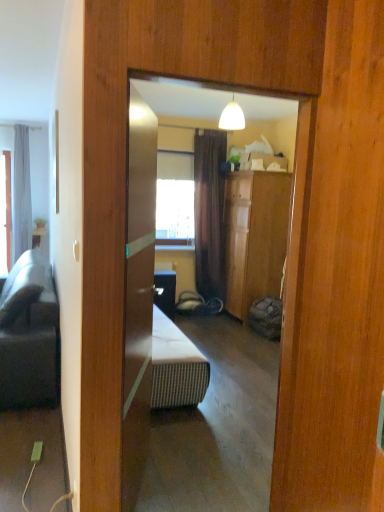
Question: Relative to matte white table at left, is gray fabric curtain at left in front or behind?

Choices:
 (A) behind
 (B) front

Answer: (B)

Question: Is gray fabric curtain at left wider or thinner than matte white table at left?

Choices:
 (A) wide
 (B) thin

Answer: (A)

Question: Which object is positioned closest to the matte white table at left?

Choices:
 (A) gray fabric curtain at left
 (B) dark gray fabric studio couch at left

Answer: (A)

Question: Considering the real-world distances, which object is closest to the dark gray fabric studio couch at left?

Choices:
 (A) gray fabric curtain at left
 (B) matte white table at left

Answer: (A)